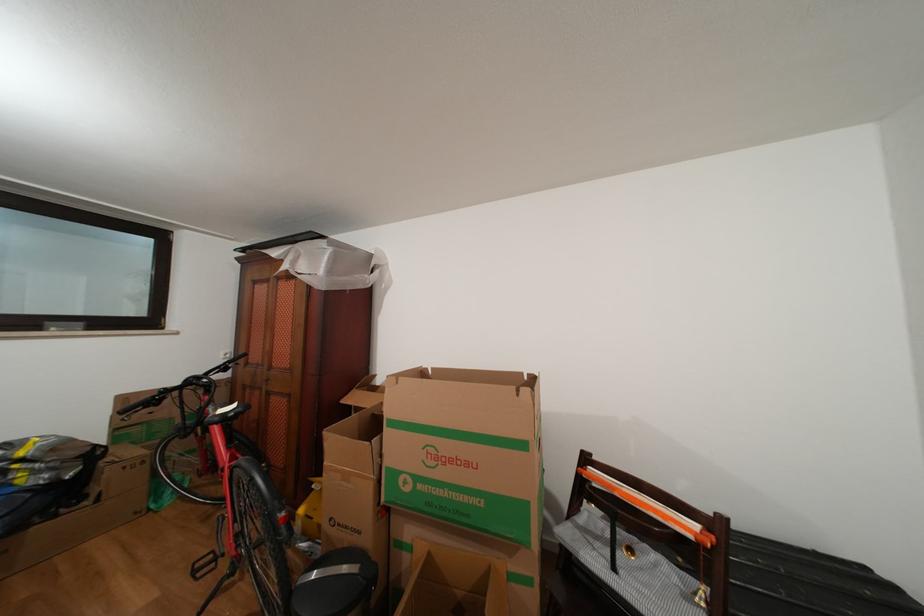
You are a GUI agent. You are given a task and a screenshot of the screen. Output one action in this format:
    pyautogui.click(x=<x>, y=<y>)
    Task: Click on the black brake lever
    This screenshot has width=924, height=616.
    Given the screenshot: What is the action you would take?
    pyautogui.click(x=225, y=363)